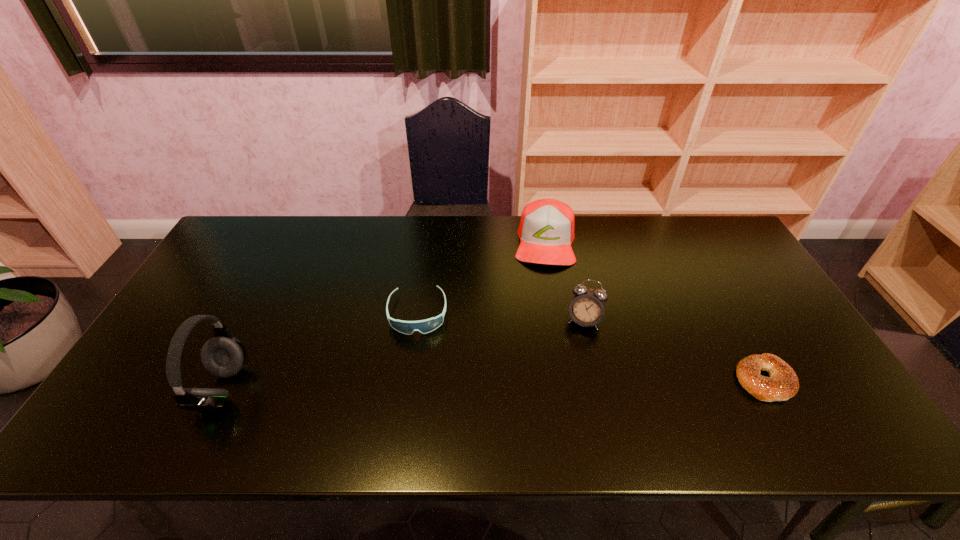
Locate which object ranks in proximity to the alarm clock. Please provide its 2D coordinates. Your answer should be formatted as a tuple, i.e. [(x, y)], where the tuple contains the x and y coordinates of a point satisfying the conditions above.

[(546, 230)]

At what (x,y) coordinates should I click in order to perform the action: click on free location that satisfies the following two spatial constraints: 1. on the front side of the alarm clock; 2. on the left side of the farthest object. Please return your answer as a coordinate pair (x, y). The image size is (960, 540). Looking at the image, I should click on (559, 320).

Locate an element on the screen. free point that satisfies the following two spatial constraints: 1. on the front side of the farthest object; 2. on the left side of the bagel is located at coordinates (569, 380).

This screenshot has height=540, width=960. I want to click on vacant space that satisfies the following two spatial constraints: 1. on the front side of the goggles; 2. on the right side of the shortest object, so (408, 380).